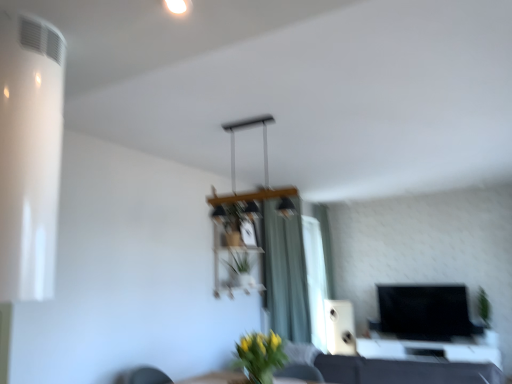
Question: From the image's perspective, is yellow matte vase at center, the 2th plant from the right, above or below green fabric curtain at center, which is the first curtain in front-to-back order?

Choices:
 (A) below
 (B) above

Answer: (A)

Question: Is point (268, 357) closer or farther from the camera than point (270, 269)?

Choices:
 (A) closer
 (B) farther

Answer: (A)

Question: Estimate the real-world distances between objects in this image. Which object is closer to the green matte vase at lower center?

Choices:
 (A) green fabric curtain at center, which is the first curtain in front-to-back order
 (B) green leafy plant at right, the first plant ordered from the bottom
 (C) green fabric curtain at right, the 2th curtain in the front-to-back sequence
 (D) white plastic air conditioner at left
 (E) wooden shelf at center

Answer: (D)

Question: Based on their relative distances, which object is farther from the white plastic air conditioner at left?

Choices:
 (A) green leafy plant at right, the 2th plant when ordered from top to bottom
 (B) green matte vase at lower center
 (C) black glossy table at lower right
 (D) white matte speaker at center
 (E) yellow matte vase at center, acting as the 1th plant starting from the front

Answer: (A)